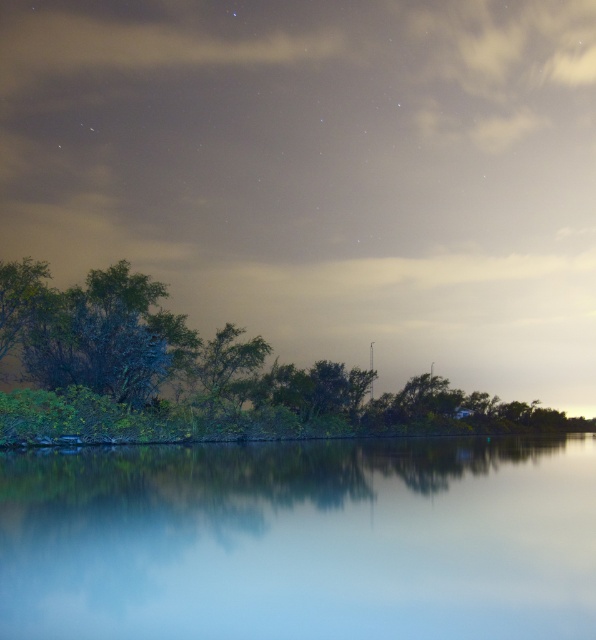
Question: Which point is farther to the camera?

Choices:
 (A) pyautogui.click(x=35, y=406)
 (B) pyautogui.click(x=389, y=563)

Answer: (A)

Question: Can you confirm if transparent glass water at center is positioned to the left of green leafy trees at left?

Choices:
 (A) no
 (B) yes

Answer: (B)

Question: Does transparent glass water at center have a lesser width compared to green leafy trees at left?

Choices:
 (A) yes
 (B) no

Answer: (A)

Question: Is transparent glass water at center positioned in front of green leafy trees at left?

Choices:
 (A) no
 (B) yes

Answer: (B)

Question: Among these objects, which one is farthest from the camera?

Choices:
 (A) transparent glass water at center
 (B) green leafy trees at left

Answer: (B)

Question: Which of the following is the farthest from the observer?

Choices:
 (A) (17, 552)
 (B) (73, 353)

Answer: (B)